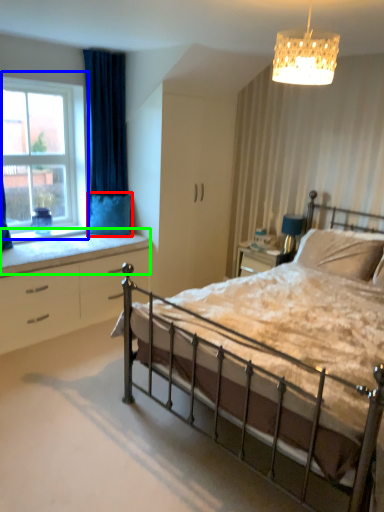
Question: Which is farther away from pillow (highlighted by a red box)? window (highlighted by a blue box) or window sill (highlighted by a green box)?

Choices:
 (A) window
 (B) window sill

Answer: (A)